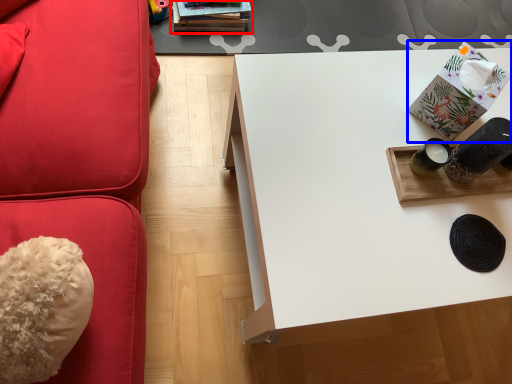
Question: Which of the following is the closest to the observer, book (highlighted by a red box) or package (highlighted by a blue box)?

Choices:
 (A) book
 (B) package

Answer: (B)